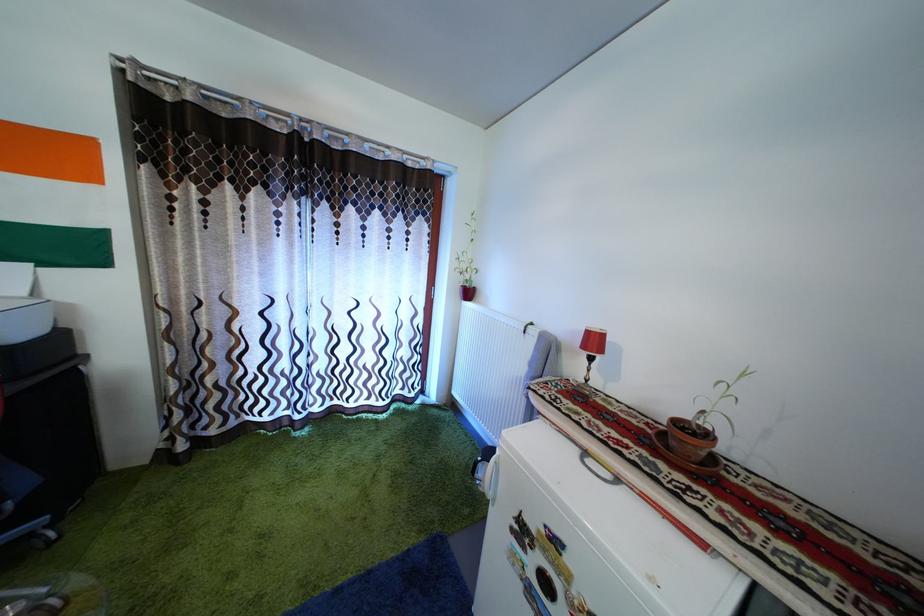
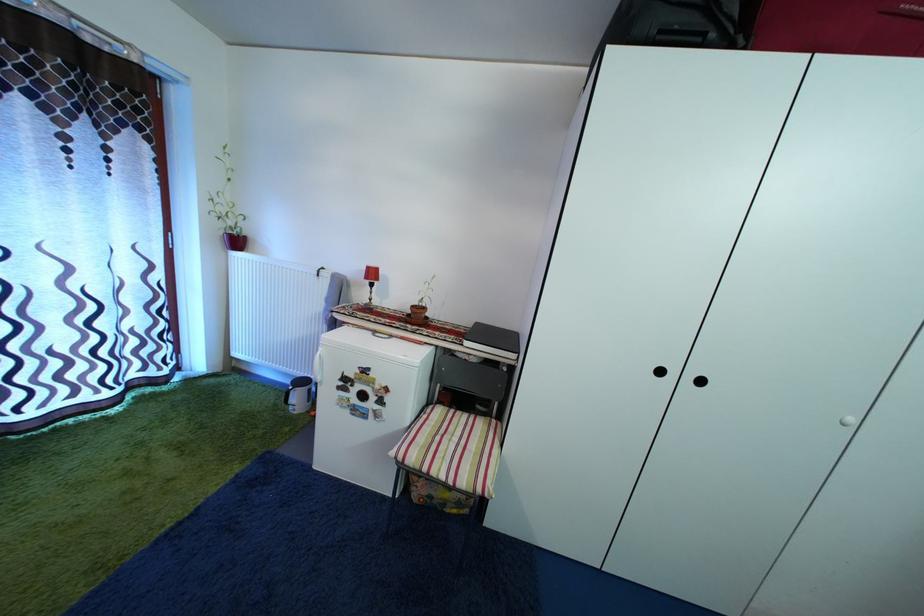
Question: The camera is either moving clockwise (left) or counter-clockwise (right) around the object. The first image is from the beginning of the video and the second image is from the end. Is the camera moving left or right when shooting the video?

Choices:
 (A) Left
 (B) Right

Answer: (A)